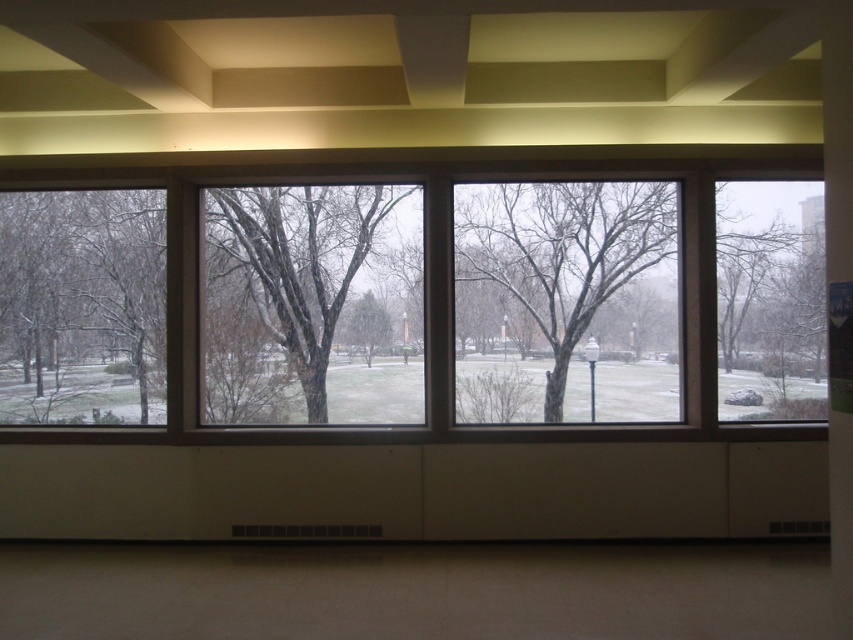
Question: Which object appears farthest from the camera in this image?

Choices:
 (A) snow-covered bark tree at center
 (B) clear glass window at center
 (C) bare branches at center
 (D) green matte tree at center

Answer: (B)

Question: Which of the following is the farthest from the observer?

Choices:
 (A) (523, 209)
 (B) (258, 234)

Answer: (B)

Question: Does bare branches at center have a larger size compared to snow-covered bark tree at center?

Choices:
 (A) yes
 (B) no

Answer: (B)

Question: Does clear glass window at center have a larger size compared to snow-covered bark tree at center?

Choices:
 (A) no
 (B) yes

Answer: (A)

Question: Estimate the real-world distances between objects in this image. Which object is closer to the bare branches at center?

Choices:
 (A) green matte tree at center
 (B) clear glass window at center
 (C) snow-covered bark tree at center

Answer: (C)

Question: Does snow-covered bark tree at center appear on the left side of green matte tree at center?

Choices:
 (A) yes
 (B) no

Answer: (A)